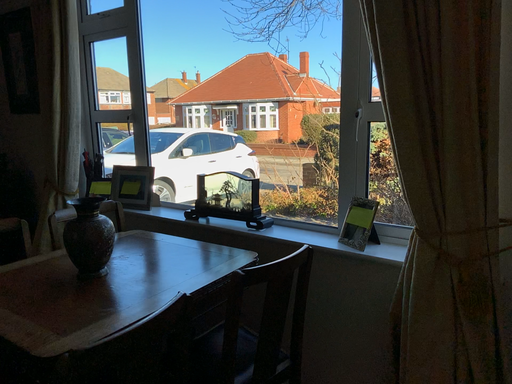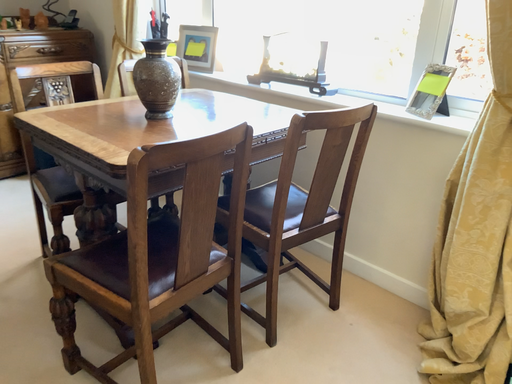
Question: How did the camera likely rotate when shooting the video?

Choices:
 (A) rotated right
 (B) rotated left

Answer: (B)